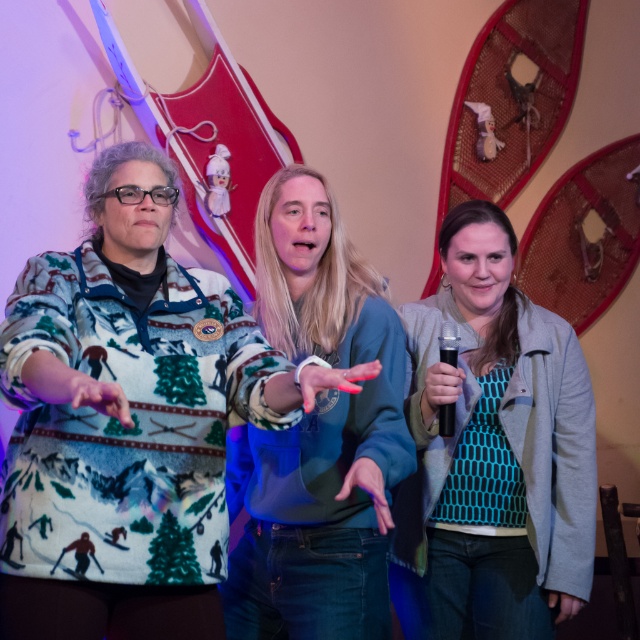
You are a photographer standing 2 meters away from the camera. You need to take a photo of the teal dotted sweater at center. Can you reach the camera to adjust it without moving closer than 1.5 meters from your current position?

The distance between you and the camera is 2 meters, and the teal dotted sweater at center is 1.72 meters away from the camera. Since 2 meters minus 1.72 meters equals 0.28 meters, you are 0.28 meters away from the sweater. To adjust the camera, you need to move closer to it, but you want to stay at least 1.5 meters from your current position. However, moving 0.48 meters towards the camera would bring you to 1.52 meters from it, which is still within the 1.5 meters limit. Wait, let me recalculate. If you...

You are a photographer taking a group photo of the three individuals. You need to ensure that the teal dotted sweater at center and the green fuzzy sweater at center are both visible in the frame. Which sweater should you position closer to the camera to avoid one blocking the other?

The teal dotted sweater at center is positioned on the right side of green fuzzy sweater at center. To ensure both are visible, position the teal dotted sweater at center closer to the camera so it doesn not get blocked by the green fuzzy sweater at center.